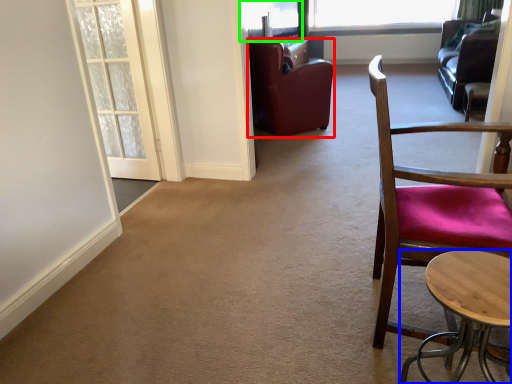
Question: Which object is positioned closest to chair (highlighted by a red box)? Select from table (highlighted by a blue box) and window screen (highlighted by a green box).

Choices:
 (A) table
 (B) window screen

Answer: (B)